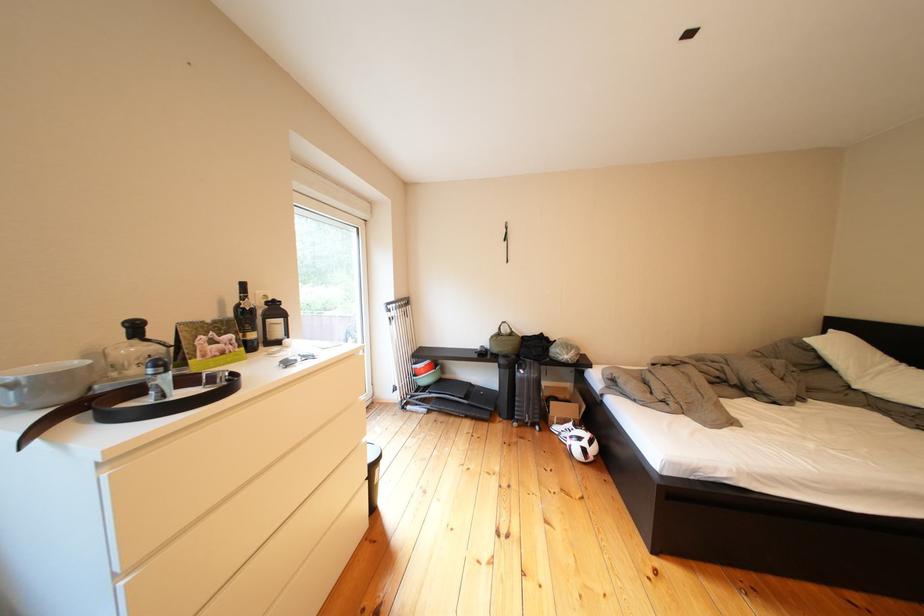
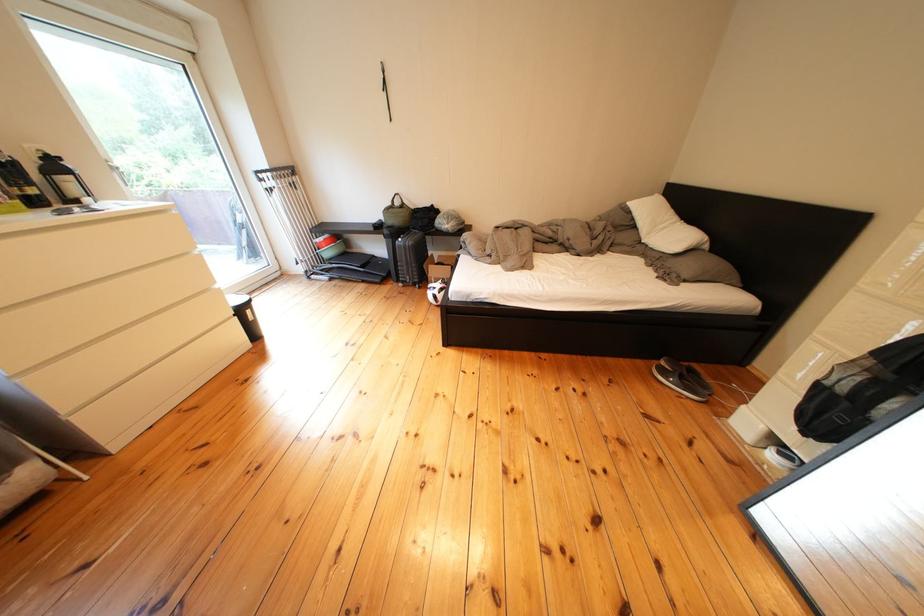
Locate, in the second image, the point that corresponds to [546,430] in the first image.

(429, 290)